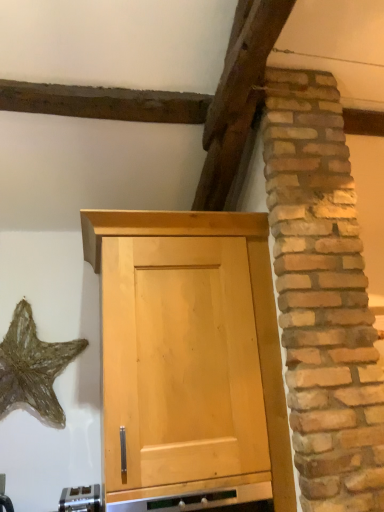
Question: Can you confirm if gold metallic starfish at lower left is bigger than satin silver toaster at lower center?

Choices:
 (A) no
 (B) yes

Answer: (B)

Question: Is gold metallic starfish at lower left further to camera compared to satin silver toaster at lower center?

Choices:
 (A) yes
 (B) no

Answer: (A)

Question: Is satin silver toaster at lower center a part of gold metallic starfish at lower left?

Choices:
 (A) no
 (B) yes

Answer: (A)

Question: Is gold metallic starfish at lower left facing away from satin silver toaster at lower center?

Choices:
 (A) no
 (B) yes

Answer: (A)

Question: From the image's perspective, is gold metallic starfish at lower left beneath satin silver toaster at lower center?

Choices:
 (A) yes
 (B) no

Answer: (B)

Question: Considering their positions, is satin silver toaster at lower center located in front of or behind gold metallic starfish at lower left?

Choices:
 (A) behind
 (B) front

Answer: (B)

Question: Looking at their shapes, would you say satin silver toaster at lower center is wider or thinner than gold metallic starfish at lower left?

Choices:
 (A) thin
 (B) wide

Answer: (B)

Question: Considering the positions of point (71, 508) and point (4, 414), is point (71, 508) closer or farther from the camera than point (4, 414)?

Choices:
 (A) farther
 (B) closer

Answer: (B)

Question: From their relative heights in the image, would you say satin silver toaster at lower center is taller or shorter than gold metallic starfish at lower left?

Choices:
 (A) tall
 (B) short

Answer: (B)

Question: Visually, is light wood cabinet at center positioned to the left or to the right of gold metallic starfish at lower left?

Choices:
 (A) left
 (B) right

Answer: (B)

Question: Which is correct: light wood cabinet at center is inside gold metallic starfish at lower left, or outside of it?

Choices:
 (A) inside
 (B) outside

Answer: (B)

Question: From their relative heights in the image, would you say light wood cabinet at center is taller or shorter than gold metallic starfish at lower left?

Choices:
 (A) tall
 (B) short

Answer: (A)

Question: In terms of size, does light wood cabinet at center appear bigger or smaller than gold metallic starfish at lower left?

Choices:
 (A) small
 (B) big

Answer: (B)

Question: Does point (11, 366) appear closer or farther from the camera than point (210, 348)?

Choices:
 (A) farther
 (B) closer

Answer: (A)

Question: From a real-world perspective, relative to light wood cabinet at center, is gold metallic starfish at lower left vertically above or below?

Choices:
 (A) above
 (B) below

Answer: (A)